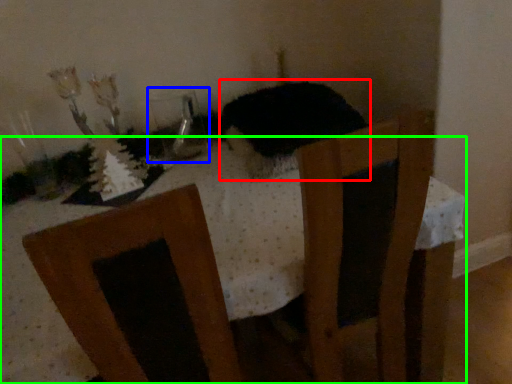
Question: Considering the real-world distances, which object is farthest from animal (highlighted by a red box)? glass vase (highlighted by a blue box) or table (highlighted by a green box)?

Choices:
 (A) glass vase
 (B) table

Answer: (A)